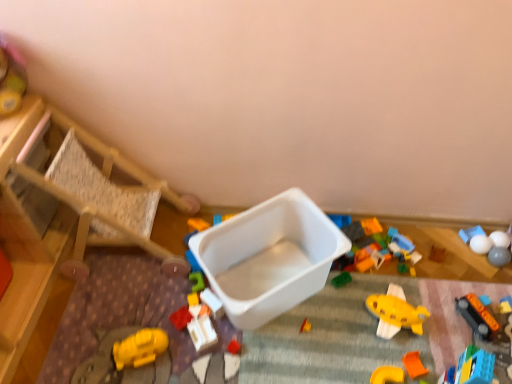
Where is `vacant area that lies between orange matte block at lower right, placed as the seventh toy when sorted from right to left, and white plastic container at center, the third toy viewed from the left`? vacant area that lies between orange matte block at lower right, placed as the seventh toy when sorted from right to left, and white plastic container at center, the third toy viewed from the left is located at coordinates (x=309, y=354).